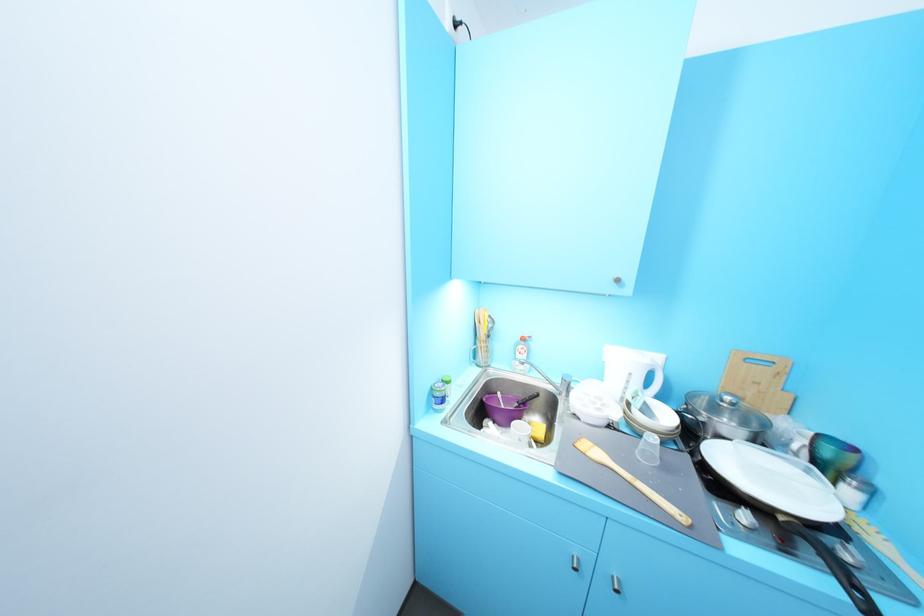
Find where to lift the black pan handle. Please return your answer as a coordinate pair (x, y).

(833, 567)